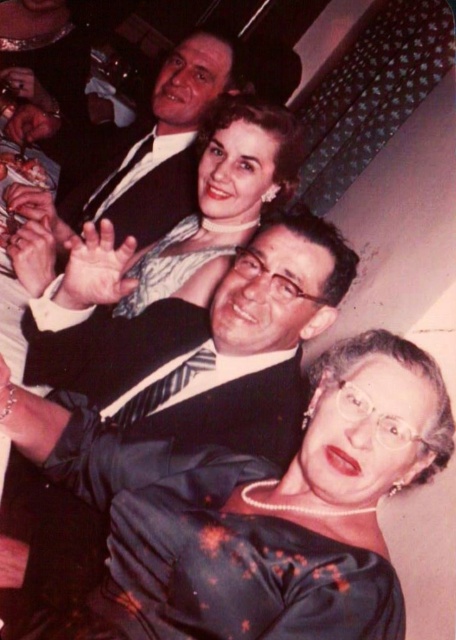
You are standing in the banquet hall and want to take a photo of the silky black dress at center. Where should you position yourself to capture it in the frame?

To capture the silky black dress at center in the frame, position yourself directly facing the center of the scene, as the silky black dress at center is located at point coordinates 0.791 on the x axis and 0.561 on the y axis, which places it centrally within the image.

You are a photographer at a 1950s themed event. You need to position two subjects for a group photo. The subjects are wearing a matte black suit at upper center and a sparkly silver dress at center. Given their sizes, which subject should you place closer to the camera to maintain visual balance?

The matte black suit at upper center is bigger than the sparkly silver dress at center, so you should place the sparkly silver dress at center closer to the camera to balance their sizes.

From the picture: You are a photographer at a formal event and need to capture a photo of the matte black suit at upper center and the sparkly silver dress at center. Based on their positions, which one is more to the left?

The matte black suit at upper center is positioned on the left side of the sparkly silver dress at center, so it is more to the left.